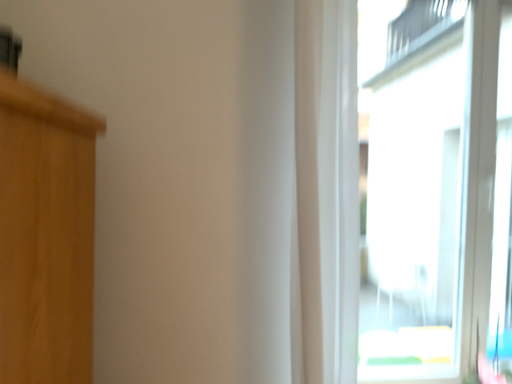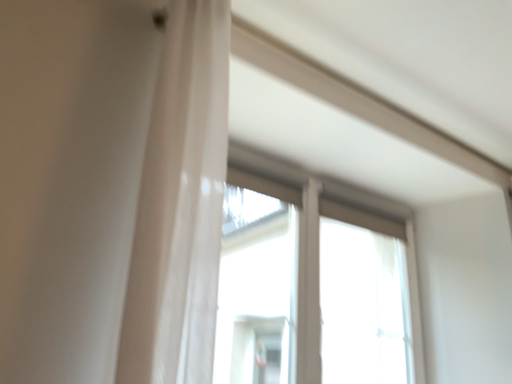
Question: How did the camera likely rotate when shooting the video?

Choices:
 (A) rotated right
 (B) rotated left

Answer: (A)